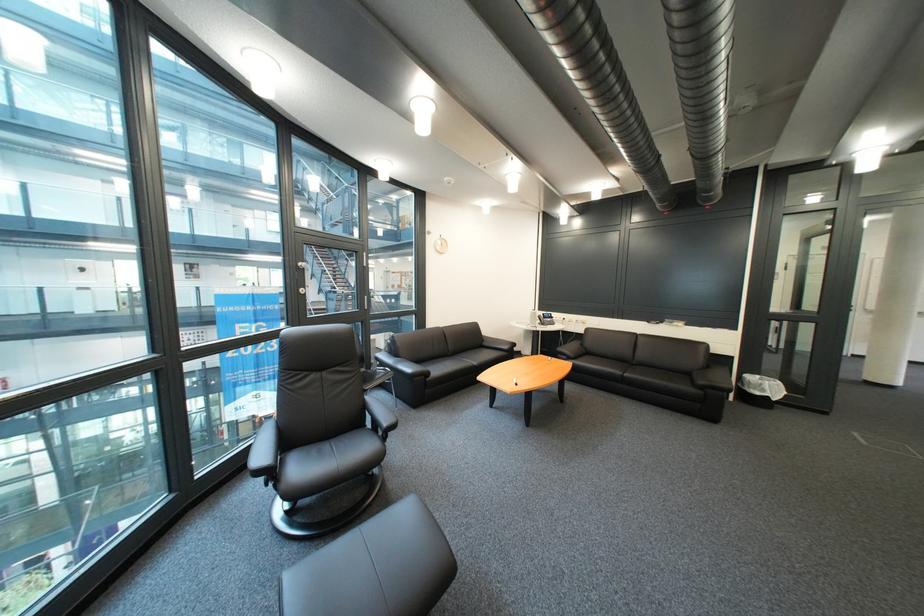
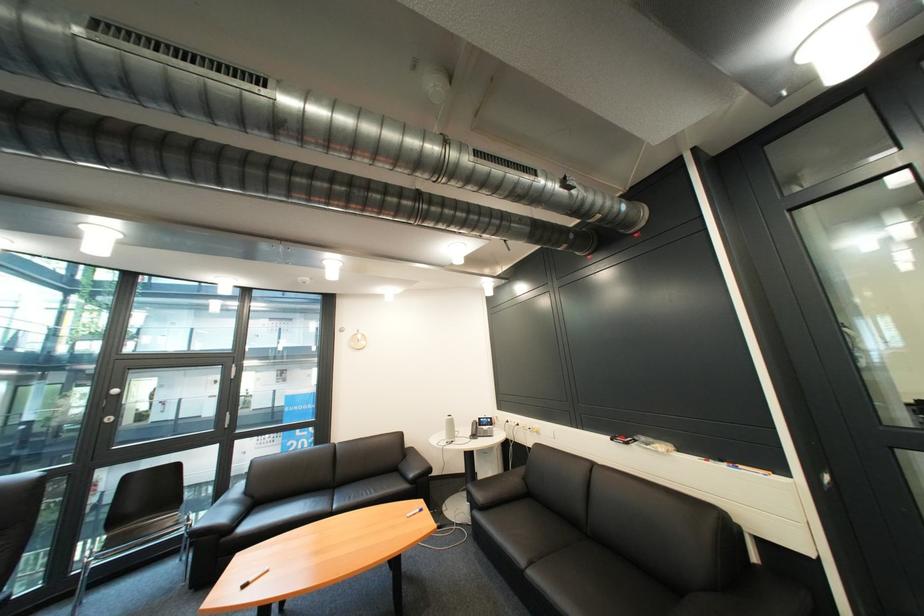
In the second image, find the point that corresponds to (594,325) in the first image.

(549, 435)